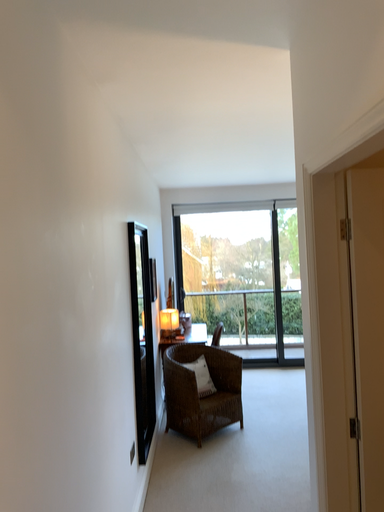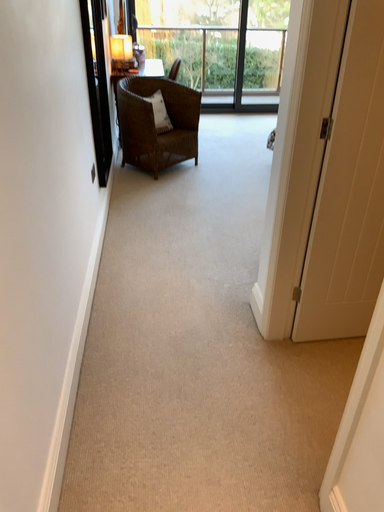
Question: Which way did the camera rotate in the video?

Choices:
 (A) rotated upward
 (B) rotated downward

Answer: (B)